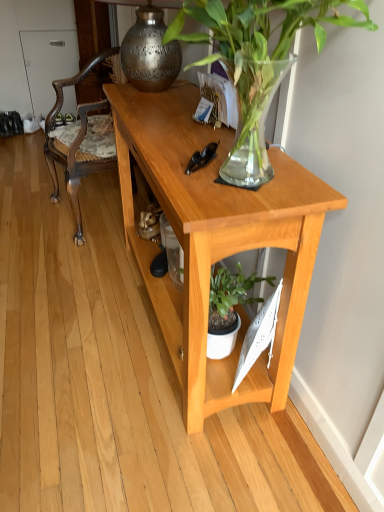
Find the location of a particular element. The height and width of the screenshot is (512, 384). vacant area that is situated to the right of black plastic sunglasses at center is located at coordinates (279, 177).